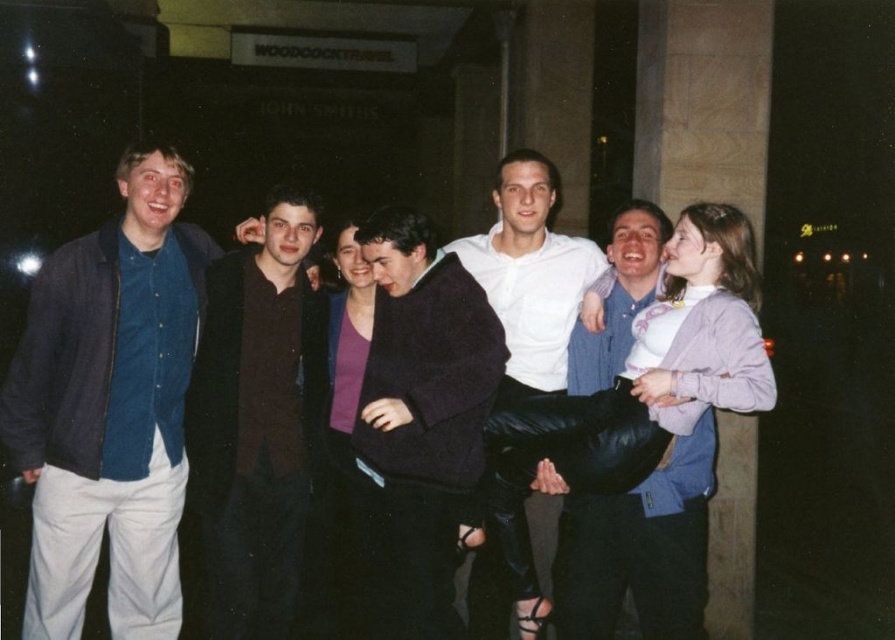
You are a photographer trying to capture a group photo of the light purple sweater at center and the white matte shirt at center. Your camera has a minimum focus distance of 3 feet. Can you focus on both subjects simultaneously?

The distance between the light purple sweater at center and the white matte shirt at center is 3.35 feet, which is greater than the camera minimum focus distance of 3 feet. Therefore, the camera can focus on both subjects simultaneously.

You are standing in front of the group of seven people in the nighttime image. There are two points marked in the scene, one at coordinates point (190, 365) and another at point (569, 273). Which point is nearer to you?

Point (190, 365) is closer to the camera than point (569, 273), so the point at (190, 365) is nearer to you.

From the picture: You are a photographer standing 2 meters away from the dark brown leather jacket at center and the white matte shirt at center. You want to take a photo that includes both subjects without moving them. Can you fit both into the frame of your camera, which has a maximum horizontal field of view of 1.5 meters at this distance?

The distance between the dark brown leather jacket at center and the white matte shirt at center is 1.46 meters. Since the camera has a maximum horizontal field of view of 1.5 meters at this distance, both subjects can fit within the frame without needing to move them.